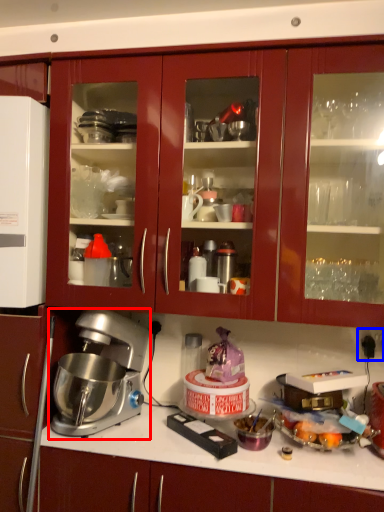
Question: Which of the following is the closest to the observer, mixer (highlighted by a red box) or electric outlet (highlighted by a blue box)?

Choices:
 (A) mixer
 (B) electric outlet

Answer: (A)